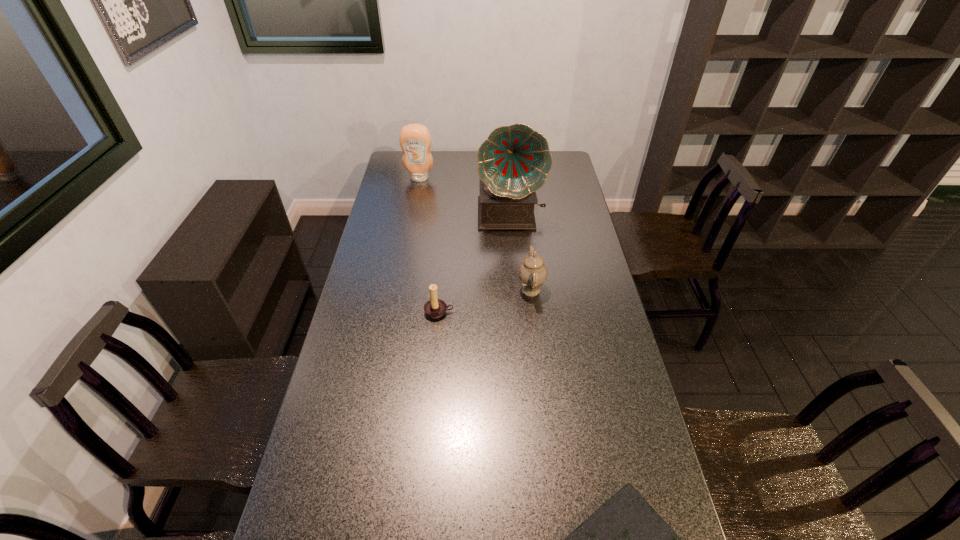
Where is `the tallest object`? The image size is (960, 540). the tallest object is located at coordinates (513, 162).

The height and width of the screenshot is (540, 960). What are the coordinates of `the fourth nearest object` in the screenshot? It's located at (513, 162).

Locate an element on the screen. The width and height of the screenshot is (960, 540). the farthest object is located at coordinates (415, 140).

Find the location of `condiment`. condiment is located at coordinates (415, 140).

Identify the location of the third shortest object. (532, 272).

Locate an element on the screen. the fourth object from right to left is located at coordinates (434, 308).

Where is `candle holder`? candle holder is located at coordinates (434, 308).

Locate an element on the screen. The width and height of the screenshot is (960, 540). vacant region located 0.160m on the horn of the record player is located at coordinates [515, 261].

I want to click on vacant space situated 0.070m on the label of the second tallest object, so [417, 191].

In order to click on free location located on the spout of the third tallest object in this screenshot , I will do [x=481, y=289].